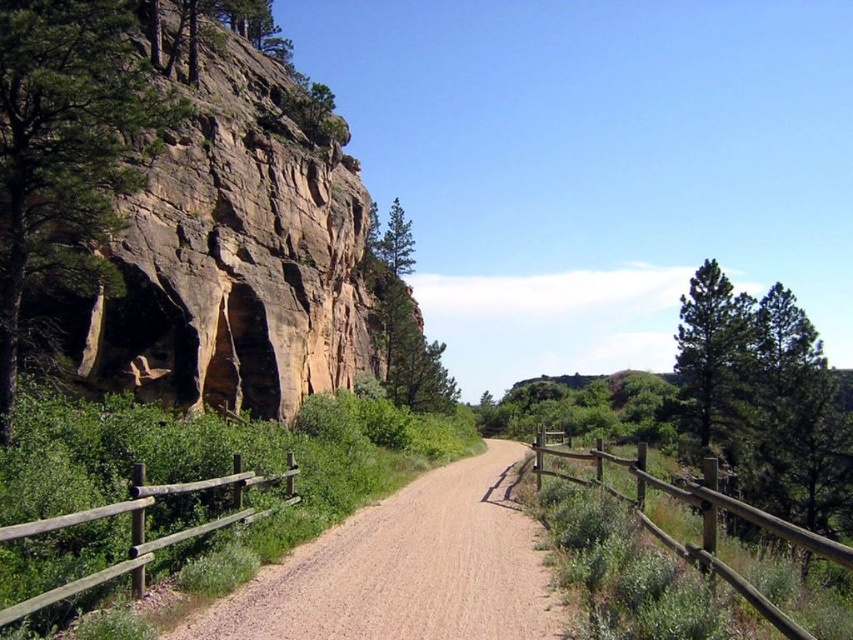
You are a hiker who wants to take a photo of both the green matte tree at right and the green textured pine tree at center. Since you have a camera with a fixed focal length, you need to stand at a position where both trees are fully visible in the frame. Based on their sizes, which tree should you position closer to the camera to ensure both are in the shot?

The green matte tree at right is larger than the green textured pine tree at center. To include both in the frame, you should position the green textured pine tree at center closer to the camera so that its smaller size balances with the larger tree in the background.

You are a hiker carrying a 2.5 meter wide tent. You need to set up camp along the path but must ensure there is enough space. Based on the image, can the brown gravel path at center accommodate your tent without crossing into the brown wooden fence at right?

The brown gravel path at center is narrower than the brown wooden fence at right. Since the path is less than 2.5 meters wide, the tent cannot be placed there without overlapping the fence.